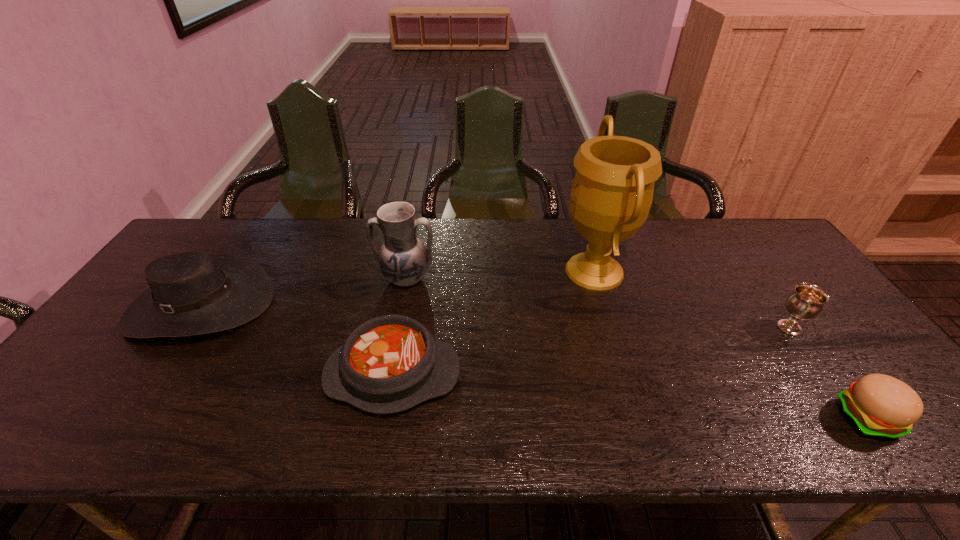
This screenshot has height=540, width=960. I want to click on vacant area that lies between the cowboy hat and the casserole, so click(x=297, y=340).

Where is `empty space between the trophy and the hamburger`? The width and height of the screenshot is (960, 540). empty space between the trophy and the hamburger is located at coordinates 732,345.

Image resolution: width=960 pixels, height=540 pixels. Identify the location of vacant space that's between the casserole and the leftmost object. (297, 340).

The image size is (960, 540). In order to click on empty space that is in between the casserole and the trophy in this screenshot , I will do `click(493, 323)`.

Identify the location of free point between the chalice and the tallest object. (692, 299).

Where is `blank region between the third tallest object and the casserole`? blank region between the third tallest object and the casserole is located at coordinates (297, 340).

At what (x,y) coordinates should I click in order to perform the action: click on free area in between the second tallest object and the hamburger. Please return your answer as a coordinate pair (x, y). This screenshot has height=540, width=960. Looking at the image, I should click on (636, 348).

You are a GUI agent. You are given a task and a screenshot of the screen. Output one action in this format:
    pyautogui.click(x=<x>, y=<y>)
    Task: Click on the fifth closest object to the chalice
    The width and height of the screenshot is (960, 540).
    Given the screenshot: What is the action you would take?
    pyautogui.click(x=192, y=293)

Point out which object is positioned as the fifth nearest to the chalice. Please provide its 2D coordinates. Your answer should be formatted as a tuple, i.e. [(x, y)], where the tuple contains the x and y coordinates of a point satisfying the conditions above.

[(192, 293)]

The image size is (960, 540). What are the coordinates of `free spot that satisfies the following two spatial constraints: 1. on the front-facing side of the hamburger; 2. on the left side of the fifth shortest object` in the screenshot? It's located at (379, 418).